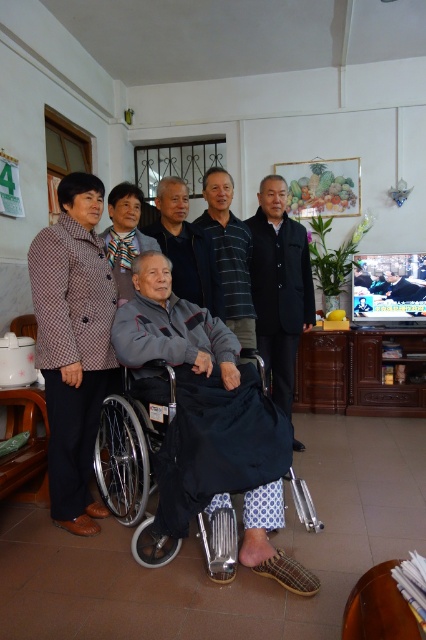
Is point (77, 301) closer to viewer compared to point (195, 252)?

Yes, point (77, 301) is in front of point (195, 252).

Can you confirm if brown textured coat at left is positioned above gray fabric jacket at center?

No, brown textured coat at left is not above gray fabric jacket at center.

Who is more distant from viewer, (88, 378) or (181, 228)?

Point (181, 228)

The width and height of the screenshot is (426, 640). I want to click on brown textured coat at left, so click(74, 344).

Can you confirm if silver metallic wheelchair at center is smaller than black matte suit at center?

Actually, silver metallic wheelchair at center might be larger than black matte suit at center.

Is silver metallic wheelchair at center taller than black matte suit at center?

Incorrect, silver metallic wheelchair at center's height is not larger of black matte suit at center's.

This screenshot has width=426, height=640. I want to click on silver metallic wheelchair at center, so click(x=154, y=481).

You are a GUI agent. You are given a task and a screenshot of the screen. Output one action in this format:
    pyautogui.click(x=<x>, y=<y>)
    Task: Click on the silver metallic wheelchair at center
    The height and width of the screenshot is (640, 426).
    Given the screenshot: What is the action you would take?
    pyautogui.click(x=154, y=481)

Is point (270, 355) positioned behind point (238, 324)?

Yes, point (270, 355) is farther from viewer.

Between black matte suit at center and striped cotton shirt at center, which one appears on the left side from the viewer's perspective?

striped cotton shirt at center

The width and height of the screenshot is (426, 640). I want to click on black matte suit at center, so click(x=279, y=288).